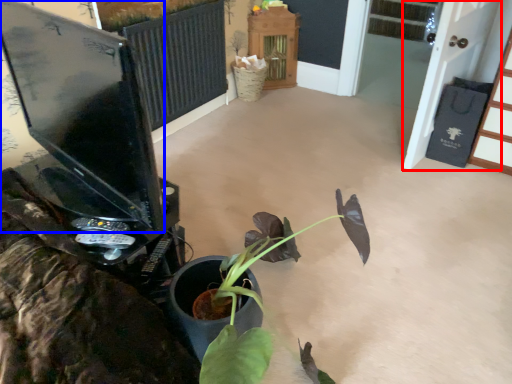
Question: Which object is further to the camera taking this photo, screen door (highlighted by a red box) or computer monitor (highlighted by a blue box)?

Choices:
 (A) screen door
 (B) computer monitor

Answer: (A)